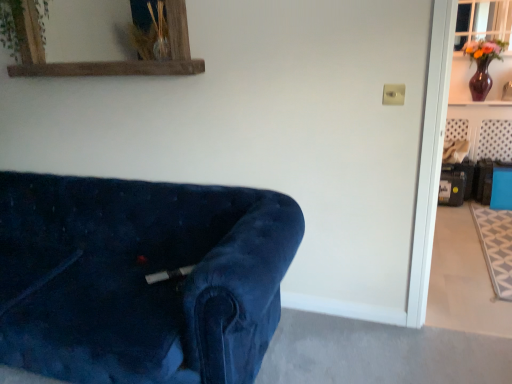
Question: In terms of height, does velvet blue couch at lower left look taller or shorter compared to clear glass window at upper right?

Choices:
 (A) tall
 (B) short

Answer: (A)

Question: Which is correct: velvet blue couch at lower left is inside clear glass window at upper right, or outside of it?

Choices:
 (A) inside
 (B) outside

Answer: (B)

Question: Which object is the farthest from the green leafy plant at upper left?

Choices:
 (A) matte purple vase at upper right
 (B) clear glass window at upper right
 (C) velvet blue couch at lower left
 (D) rustic wood mirror at upper left

Answer: (A)

Question: Estimate the real-world distances between objects in this image. Which object is farther from the matte purple vase at upper right?

Choices:
 (A) velvet blue couch at lower left
 (B) green leafy plant at upper left
 (C) rustic wood mirror at upper left
 (D) clear glass window at upper right

Answer: (B)